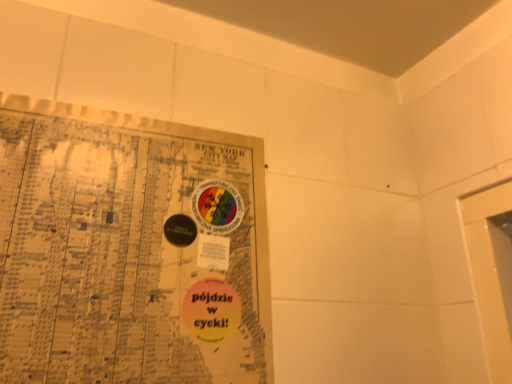
In order to face yellowed paper map at upper left, should I rotate leftwards or rightwards?

You should rotate left by 14.460 degrees.

I want to click on yellowed paper map at upper left, so click(130, 250).

This screenshot has width=512, height=384. Describe the element at coordinates (130, 250) in the screenshot. I see `yellowed paper map at upper left` at that location.

Where is `yellowed paper map at upper left`? This screenshot has height=384, width=512. yellowed paper map at upper left is located at coordinates (130, 250).